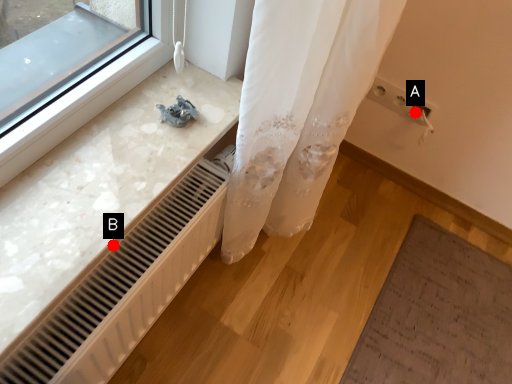
Question: Two points are circled on the image, labeled by A and B beside each circle. Which of the following is the closest to the observer?

Choices:
 (A) A is closer
 (B) B is closer

Answer: (B)